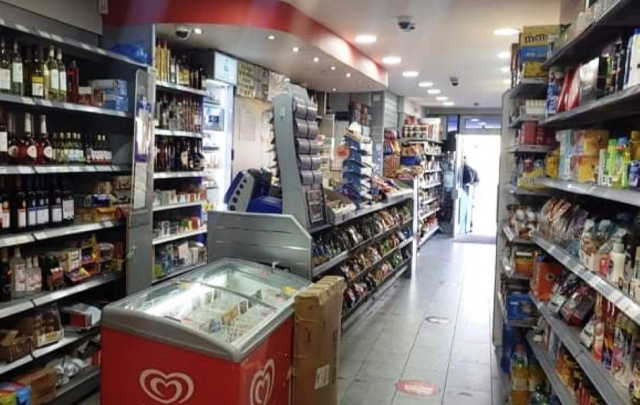
In order to click on track lighting over checkout in this screenshot , I will do `click(202, 32)`, `click(269, 38)`, `click(292, 51)`, `click(314, 61)`, `click(331, 67)`, `click(347, 76)`.